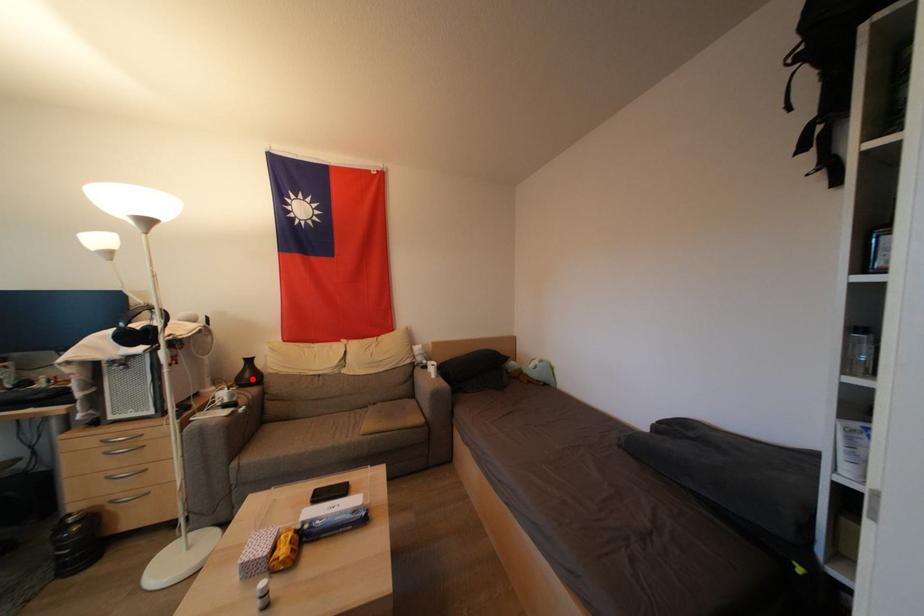
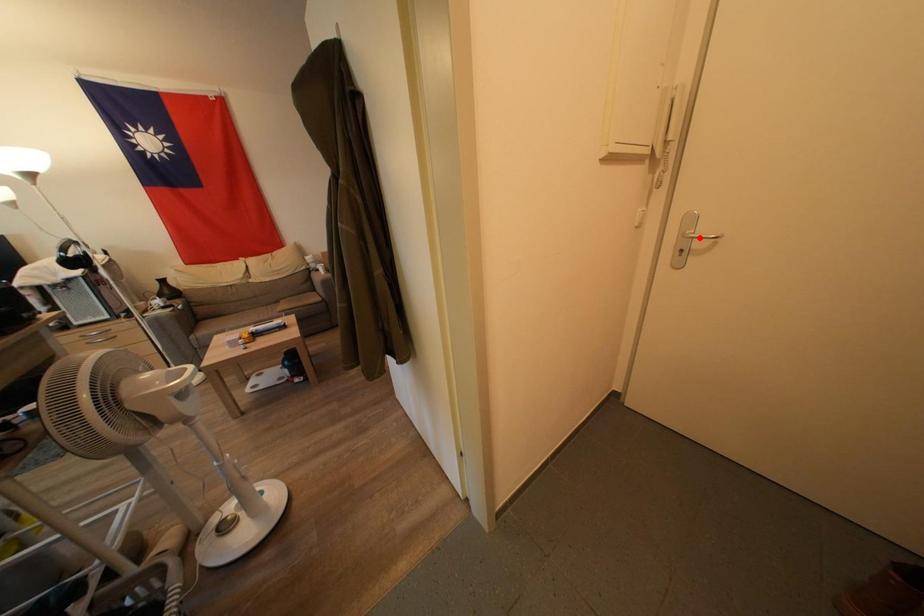
I am providing you with two images of the same scene from different viewpoints. A red point is marked on the first image and another point is marked on the second image. Is the red point in image1 aligned with the point shown in image2?

No